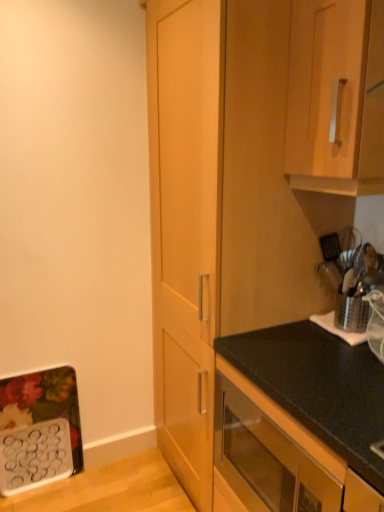
Question: Is point (319, 266) positioned closer to the camera than point (230, 462)?

Choices:
 (A) farther
 (B) closer

Answer: (A)

Question: Is silver metallic utensil holder at right inside or outside of wooden cabinet at center, acting as the second cabinetry starting from the bottom?

Choices:
 (A) outside
 (B) inside

Answer: (A)

Question: Which object is the farthest from the wooden cabinet at center, the second cabinetry viewed from the top?

Choices:
 (A) black matte oven at lower center, the first cabinetry ordered from the bottom
 (B) silver metallic utensil holder at right
 (C) wooden cabinet handle at upper right, which appears as the 1th cabinetry when viewed from the top

Answer: (B)

Question: Based on their relative distances, which object is nearer to the black matte oven at lower center, which is counted as the 3th cabinetry, starting from the top?

Choices:
 (A) silver metallic utensil holder at right
 (B) wooden cabinet handle at upper right, the third cabinetry when ordered from bottom to top
 (C) wooden cabinet at center, acting as the second cabinetry starting from the bottom

Answer: (C)